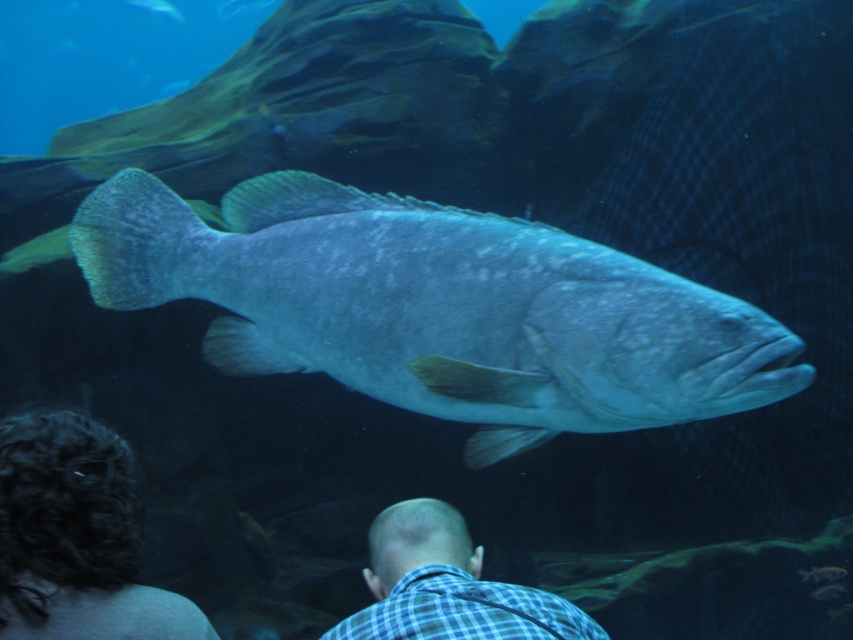
Question: From the image, what is the correct spatial relationship of dark curly hair at lower left in relation to blue checkered shirt at lower center?

Choices:
 (A) below
 (B) above

Answer: (B)

Question: Does shiny blue fish at center appear under blue checkered shirt at lower center?

Choices:
 (A) yes
 (B) no

Answer: (B)

Question: Is shiny blue fish at center further to the viewer compared to blue checkered shirt at lower center?

Choices:
 (A) yes
 (B) no

Answer: (B)

Question: Among these points, which one is farthest from the camera?

Choices:
 (A) (677, 364)
 (B) (412, 616)

Answer: (B)

Question: Estimate the real-world distances between objects in this image. Which object is farther from the dark curly hair at lower left?

Choices:
 (A) blue checkered shirt at lower center
 (B) shiny blue fish at center

Answer: (A)

Question: Which object is farther from the camera taking this photo?

Choices:
 (A) dark curly hair at lower left
 (B) shiny blue fish at center

Answer: (B)